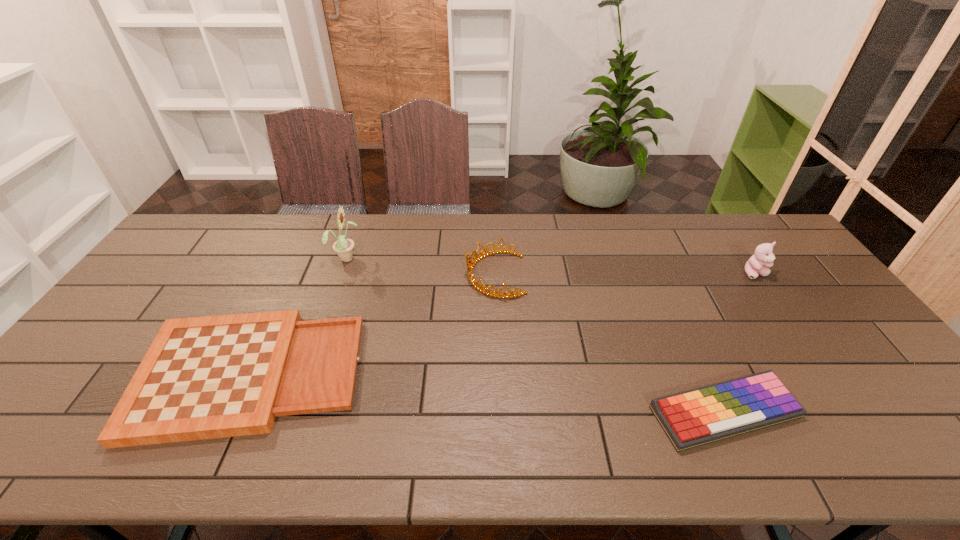
Where is `free spot between the gameboard and the teddy bear`? free spot between the gameboard and the teddy bear is located at coordinates (503, 325).

You are a GUI agent. You are given a task and a screenshot of the screen. Output one action in this format:
    pyautogui.click(x=<x>, y=<y>)
    Task: Click on the empty space between the rightmost object and the fourth object from left to right
    This screenshot has width=960, height=540.
    Given the screenshot: What is the action you would take?
    pyautogui.click(x=740, y=343)

The height and width of the screenshot is (540, 960). I want to click on object that is the third closest to the fourth object from left to right, so click(209, 377).

Select which object is the third closest to the gameboard. Please provide its 2D coordinates. Your answer should be formatted as a tuple, i.e. [(x, y)], where the tuple contains the x and y coordinates of a point satisfying the conditions above.

[(700, 416)]

In order to click on vacant area in the image that satisfies the following two spatial constraints: 1. on the front-facing side of the third object from right to left; 2. on the left side of the fourth object from left to right in this screenshot , I will do `click(500, 412)`.

The image size is (960, 540). Find the location of `vacant area that satisfies the following two spatial constraints: 1. on the front side of the second object from right to left; 2. on the right side of the gameboard`. vacant area that satisfies the following two spatial constraints: 1. on the front side of the second object from right to left; 2. on the right side of the gameboard is located at coordinates (233, 412).

Where is `vacant area in the image that satisfies the following two spatial constraints: 1. on the front-facing side of the third object from right to left; 2. on the front side of the gameboard`? vacant area in the image that satisfies the following two spatial constraints: 1. on the front-facing side of the third object from right to left; 2. on the front side of the gameboard is located at coordinates (499, 375).

Find the location of a particular element. vacant region that satisfies the following two spatial constraints: 1. on the front-facing side of the second object from right to left; 2. on the right side of the tallest object is located at coordinates (292, 412).